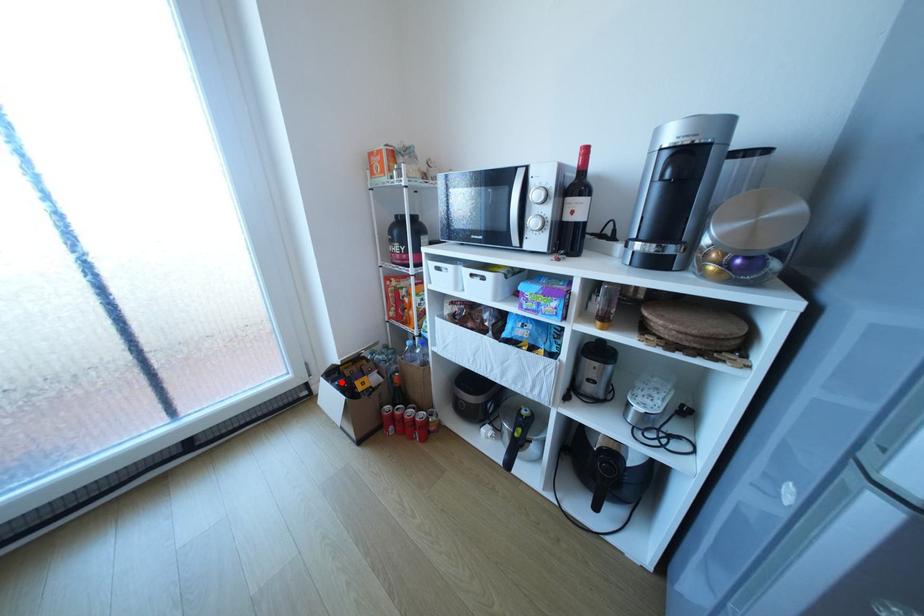
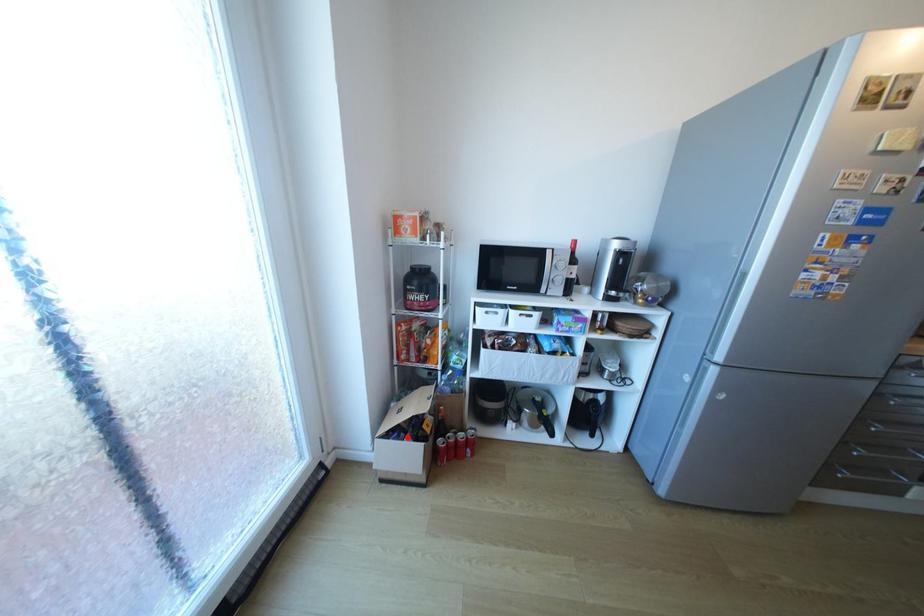
I am providing you with two images of the same scene from different viewpoints. A red point is marked on the first image and another point is marked on the second image. Is the red point in image1 aligned with the point shown in image2?

Yes